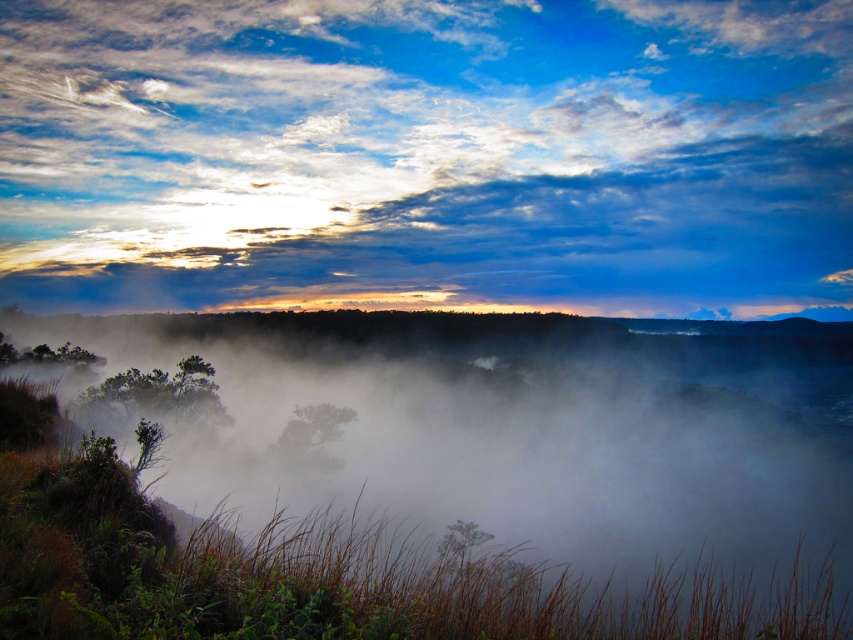
Please provide the 2D coordinates of the cloudy sky at upper center in the image. The coordinates should be in the format of a tuple with two decimal numbers separated by a comma, enclosed in parentheses. For example, the format would be like this for a sample coordinate point at the center of the image, which is at 0.5,0.5.

The 2D coordinates of the cloudy sky at upper center are at point (427, 156).

You are an astronomer observing the sky in the image. You notice a point at coordinates (427, 156). What is located at this point?

The point at coordinates (427, 156) indicates cloudy sky at upper center.

You are an observer standing in the landscape. You see the cloudy sky at upper center and the white misty fog at center. Which object is above the other?

The cloudy sky at upper center is positioned over white misty fog at center, so the cloudy sky at upper center is above the white misty fog at center.